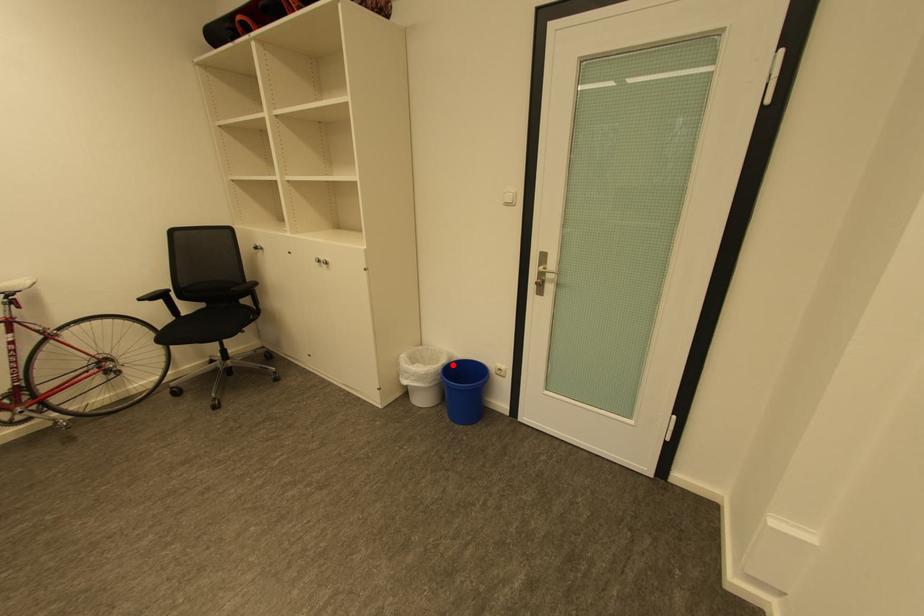
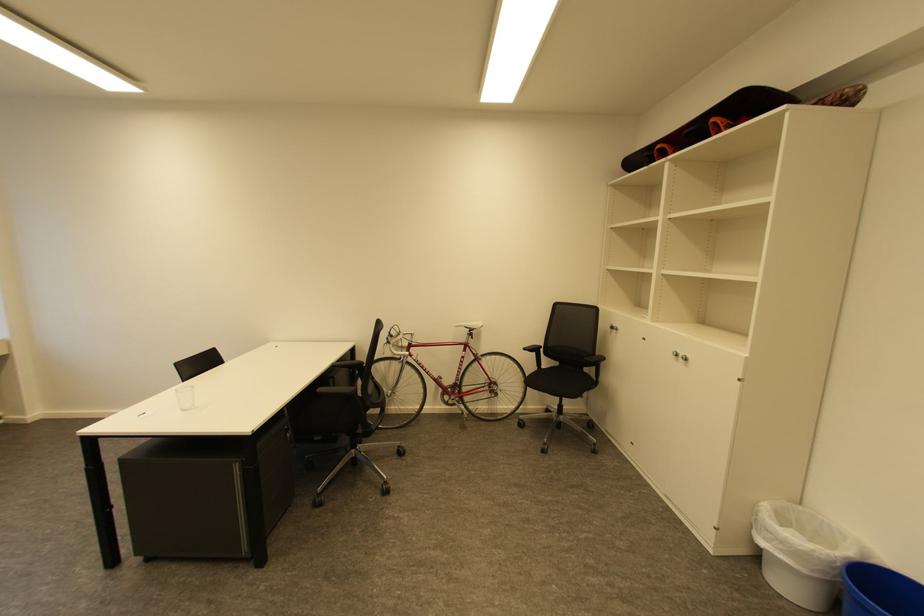
In the second image, find the point that corresponds to the highlighted location in the first image.

(860, 561)